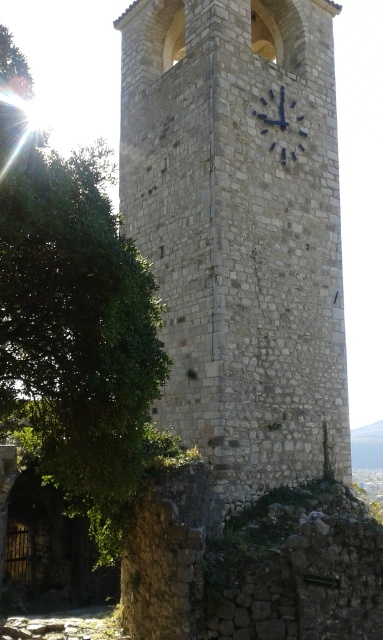
You are standing in a park and see the white stone clock tower at center and the green leafy tree at left. Which object appears larger in the image?

The green leafy tree at left appears larger than the white stone clock tower at center in the image.

Based on the scene description, where is the white stone clock tower at center located in terms of its 2D coordinates?

The white stone clock tower at center is located at the 2D coordinates of point (x=240, y=230).